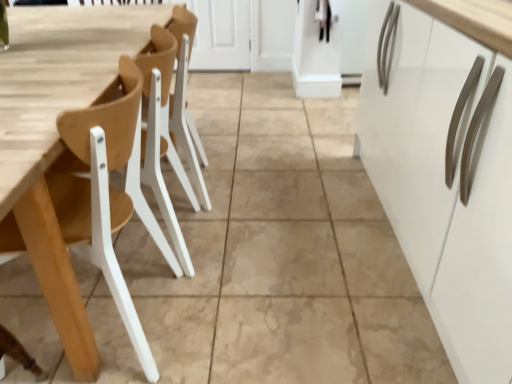
Question: Can you confirm if wooden chair at left is wider than natural wood table at left?

Choices:
 (A) yes
 (B) no

Answer: (A)

Question: Is wooden chair at left facing away from natural wood table at left?

Choices:
 (A) no
 (B) yes

Answer: (A)

Question: Is wooden chair at left outside natural wood table at left?

Choices:
 (A) yes
 (B) no

Answer: (A)

Question: Is wooden chair at left further to the viewer compared to natural wood table at left?

Choices:
 (A) no
 (B) yes

Answer: (A)

Question: Is the depth of wooden chair at left less than that of natural wood table at left?

Choices:
 (A) no
 (B) yes

Answer: (B)

Question: Considering the relative sizes of wooden chair at left and natural wood table at left in the image provided, is wooden chair at left taller than natural wood table at left?

Choices:
 (A) yes
 (B) no

Answer: (A)

Question: Could you tell me if natural wood table at left is facing wooden chair at left?

Choices:
 (A) yes
 (B) no

Answer: (B)

Question: From a real-world perspective, is natural wood table at left located higher than wooden chair at left?

Choices:
 (A) no
 (B) yes

Answer: (A)

Question: Is natural wood table at left wider than wooden chair at left?

Choices:
 (A) no
 (B) yes

Answer: (A)

Question: Can you confirm if natural wood table at left is positioned to the right of wooden chair at left?

Choices:
 (A) yes
 (B) no

Answer: (A)

Question: From the image's perspective, is natural wood table at left beneath wooden chair at left?

Choices:
 (A) no
 (B) yes

Answer: (A)

Question: Is natural wood table at left not inside wooden chair at left?

Choices:
 (A) no
 (B) yes

Answer: (B)

Question: From their relative heights in the image, would you say wooden chair at left is taller or shorter than natural wood table at left?

Choices:
 (A) tall
 (B) short

Answer: (A)